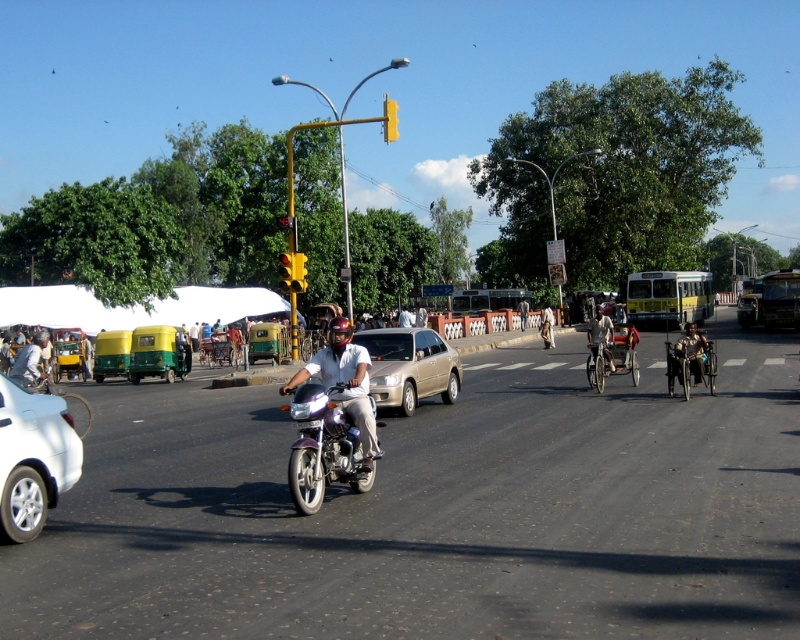
Question: Among these objects, which one is farthest from the camera?

Choices:
 (A) light beige fabric bicycle at center
 (B) gold metallic sedan at center
 (C) metallic purple motorcycle at center

Answer: (A)

Question: Is white glossy car at lower left positioned at the back of metallic purple motorcycle at center?

Choices:
 (A) yes
 (B) no

Answer: (B)

Question: Can you confirm if white glossy car at lower left is wider than light beige fabric bicycle at center?

Choices:
 (A) no
 (B) yes

Answer: (A)

Question: Considering the relative positions of metallic purple motorcycle at center and light brown fabric cloth at center in the image provided, where is metallic purple motorcycle at center located with respect to light brown fabric cloth at center?

Choices:
 (A) above
 (B) below

Answer: (B)

Question: Which is nearer to the dark brown leather jacket at center?

Choices:
 (A) light beige fabric bicycle at center
 (B) metallic purple motorcycle at center
 (C) white glossy car at lower left

Answer: (A)

Question: Which is nearer to the light beige fabric bicycle at center?

Choices:
 (A) metallic purple motorcycle at center
 (B) gold metallic sedan at center
 (C) light brown fabric cloth at center

Answer: (B)